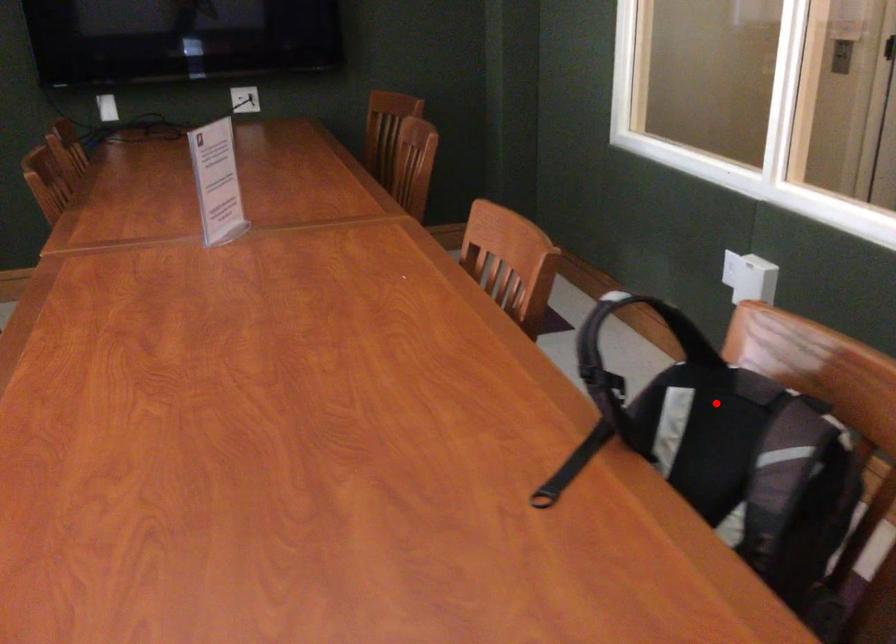
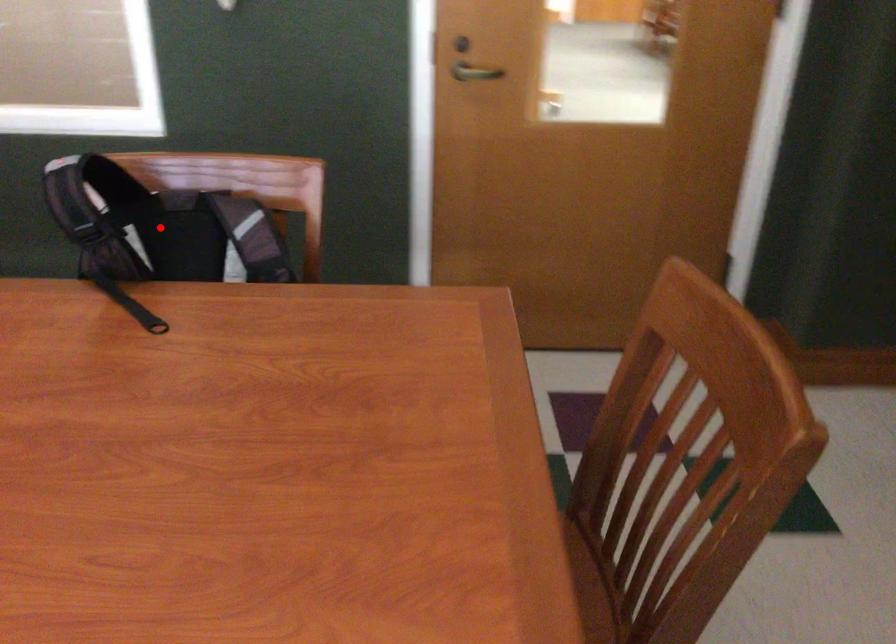
I am providing you with two images of the same scene from different viewpoints. A red point is marked on the first image and another point is marked on the second image. Do the highlighted points in image1 and image2 indicate the same real-world spot?

No